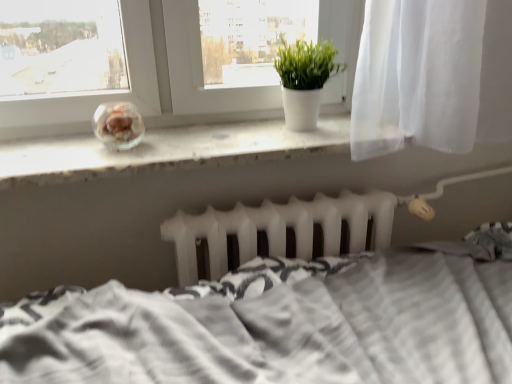
Question: Can you confirm if translucent glass jar at center is bigger than white textured bed at center?

Choices:
 (A) no
 (B) yes

Answer: (A)

Question: Is translucent glass jar at center wider than white textured bed at center?

Choices:
 (A) yes
 (B) no

Answer: (B)

Question: Would you say white textured bed at center is part of translucent glass jar at center's contents?

Choices:
 (A) no
 (B) yes

Answer: (A)

Question: Is translucent glass jar at center facing towards white textured bed at center?

Choices:
 (A) yes
 (B) no

Answer: (B)

Question: Is the position of translucent glass jar at center less distant than that of white textured bed at center?

Choices:
 (A) no
 (B) yes

Answer: (A)

Question: Is translucent glass jar at center to the right of white textured bed at center from the viewer's perspective?

Choices:
 (A) yes
 (B) no

Answer: (B)

Question: From the image's perspective, is white textured bed at center on top of white matte radiator at center?

Choices:
 (A) yes
 (B) no

Answer: (B)

Question: Is the surface of white textured bed at center in direct contact with white matte radiator at center?

Choices:
 (A) yes
 (B) no

Answer: (B)

Question: Is white textured bed at center closer to the viewer compared to white matte radiator at center?

Choices:
 (A) yes
 (B) no

Answer: (A)

Question: Does white textured bed at center have a lesser height compared to white matte radiator at center?

Choices:
 (A) no
 (B) yes

Answer: (A)

Question: Is white textured bed at center oriented away from white matte radiator at center?

Choices:
 (A) no
 (B) yes

Answer: (A)

Question: Would you consider white textured bed at center to be distant from white matte radiator at center?

Choices:
 (A) yes
 (B) no

Answer: (B)

Question: Considering the relative positions of white textured bed at center and green matte plant at center in the image provided, is white textured bed at center to the left of green matte plant at center from the viewer's perspective?

Choices:
 (A) no
 (B) yes

Answer: (A)